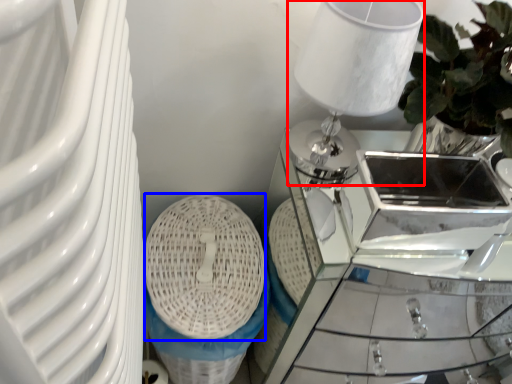
Question: Which of the following is the farthest to the observer, table lamp (highlighted by a red box) or basket (highlighted by a blue box)?

Choices:
 (A) table lamp
 (B) basket

Answer: (B)